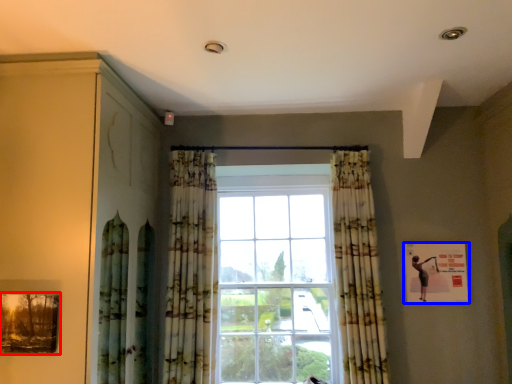
Question: Which of the following is the farthest to the observer, picture frame (highlighted by a red box) or picture frame (highlighted by a blue box)?

Choices:
 (A) picture frame
 (B) picture frame

Answer: (B)